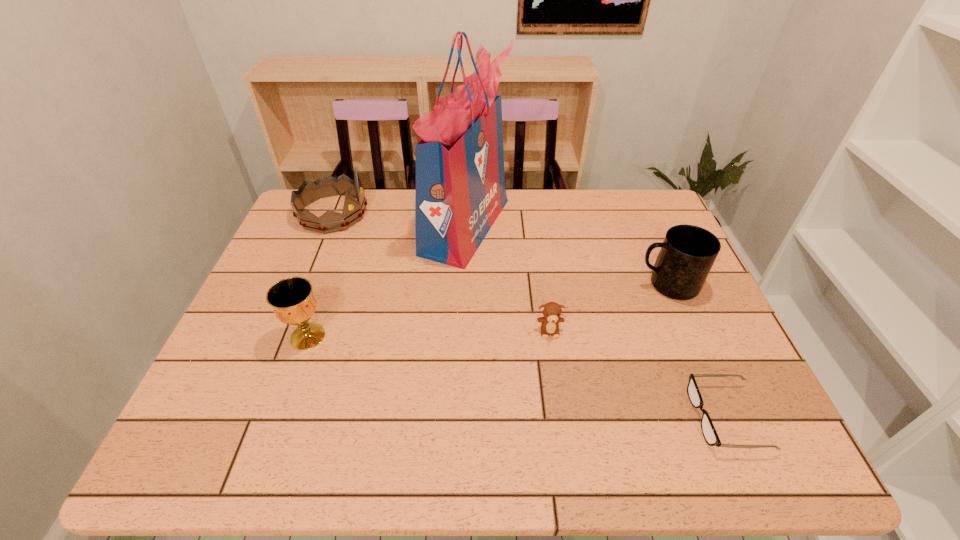
Image resolution: width=960 pixels, height=540 pixels. I want to click on the tallest object, so (460, 191).

Locate an element on the screen. The height and width of the screenshot is (540, 960). grocery bag is located at coordinates (460, 191).

Locate an element on the screen. tiara is located at coordinates [x=325, y=186].

Locate an element on the screen. mug is located at coordinates (688, 252).

The height and width of the screenshot is (540, 960). Identify the location of chalice. (292, 300).

The image size is (960, 540). I want to click on teddy bear, so click(552, 311).

Locate an element on the screen. the second shortest object is located at coordinates (552, 311).

Locate an element on the screen. This screenshot has height=540, width=960. the shortest object is located at coordinates click(710, 435).

The height and width of the screenshot is (540, 960). Find the location of `spectacles`. spectacles is located at coordinates (710, 435).

In order to click on vacant region located 0.130m on the front-facing side of the third object from left to right in this screenshot , I will do `click(552, 226)`.